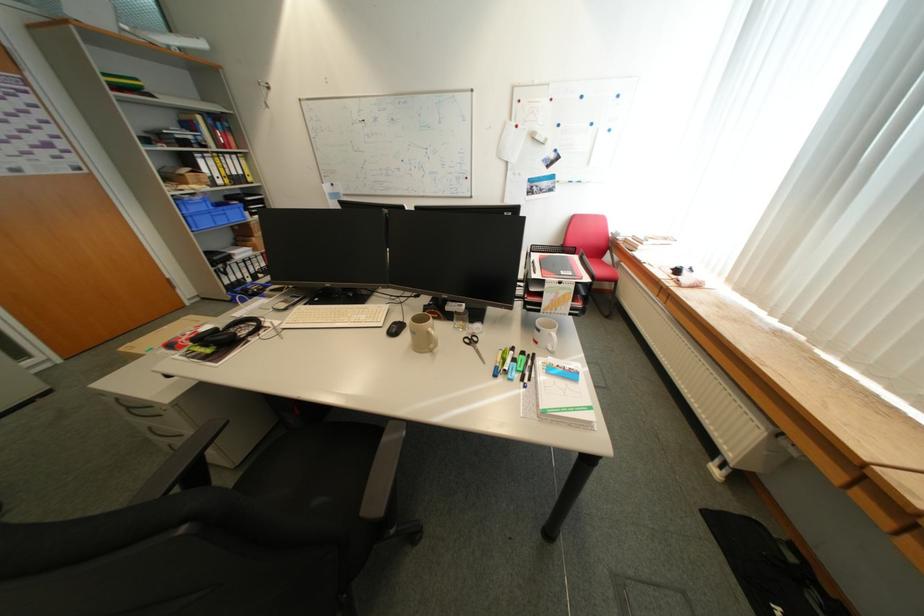
Locate an element on the screen. The height and width of the screenshot is (616, 924). white coffee mug is located at coordinates (545, 333).